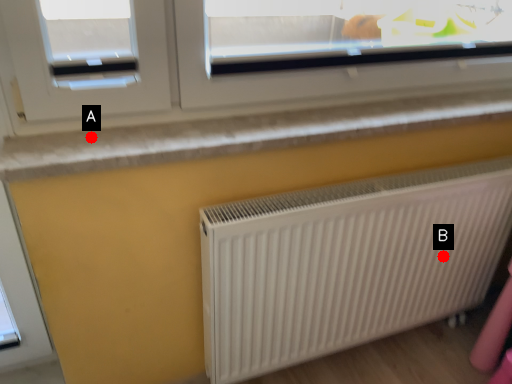
Question: Two points are circled on the image, labeled by A and B beside each circle. Among these points, which one is farthest from the camera?

Choices:
 (A) A is further
 (B) B is further

Answer: (B)